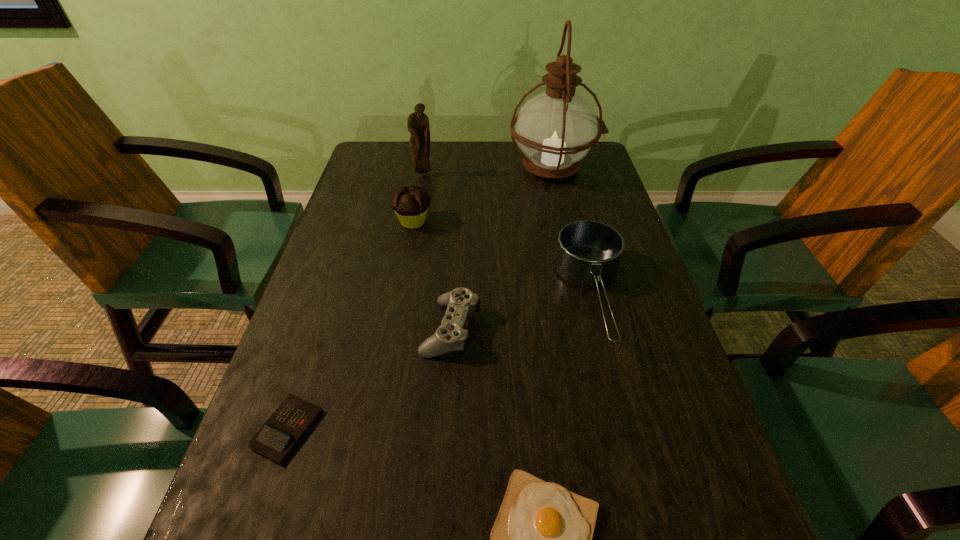
Identify the location of unoccupied area between the muffin and the oil lamp. The height and width of the screenshot is (540, 960). (483, 195).

Locate which object ranks fourth in proximity to the fourth object from right to left. Please provide its 2D coordinates. Your answer should be formatted as a tuple, i.e. [(x, y)], where the tuple contains the x and y coordinates of a point satisfying the conditions above.

[(410, 204)]

Find the location of a particular element. The image size is (960, 540). object that stands as the fifth closest to the saucepan is located at coordinates pos(418,125).